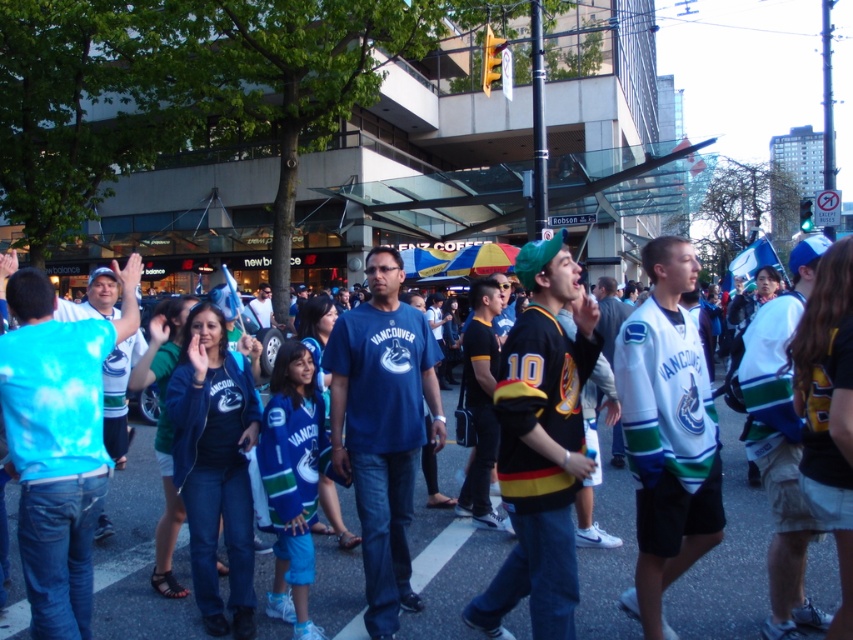
You are standing at the point labeled as point (757, 612) in the image. A friend is located 4.50 meters away from you. Where is your friend standing relative to your position?

Your friend is standing 4.50 meters away from point (757, 612).